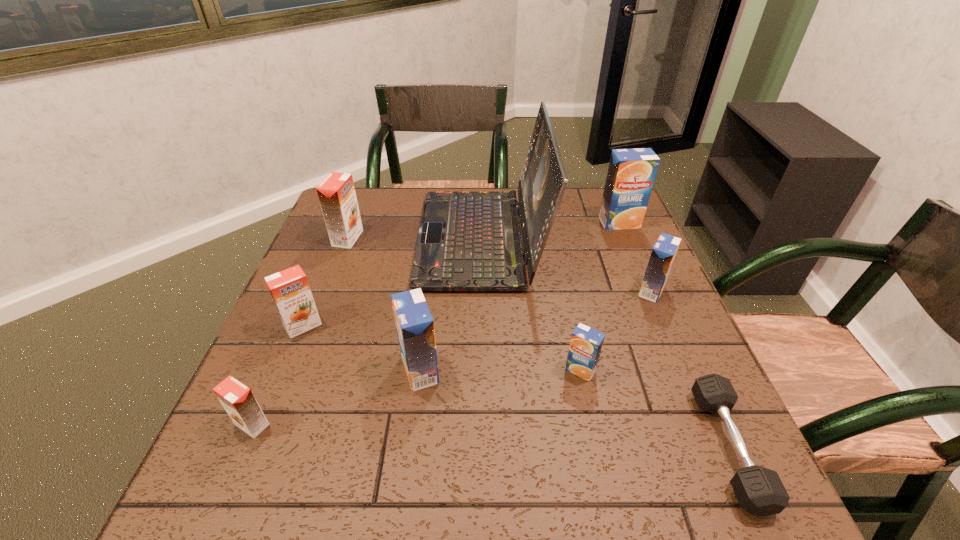
Find the location of `object located in the far right corner section of the desktop`. object located in the far right corner section of the desktop is located at coordinates (631, 173).

Locate an element on the screen. Image resolution: width=960 pixels, height=540 pixels. object that is at the near right corner is located at coordinates pos(760,491).

Find the location of a particular element. blank space at the far edge is located at coordinates (565, 202).

Image resolution: width=960 pixels, height=540 pixels. In the image, there is a desktop. In order to click on free space at the near edge in this screenshot , I will do `click(443, 483)`.

In the image, there is a desktop. In order to click on free space at the left edge in this screenshot , I will do `click(326, 238)`.

Where is `free location at the right edge of the desktop`? The image size is (960, 540). free location at the right edge of the desktop is located at coordinates (649, 252).

This screenshot has width=960, height=540. I want to click on free space at the near left corner of the desktop, so click(x=278, y=471).

Locate an element on the screen. vacant space at the near right corner is located at coordinates (706, 474).

Identify the location of unoccupied area between the second smallest blue orange_juice and the second smallest orange orange juice. (477, 308).

Image resolution: width=960 pixels, height=540 pixels. What are the coordinates of `empty location between the leftmost blue orange_juice and the dumbbell` in the screenshot? It's located at (574, 409).